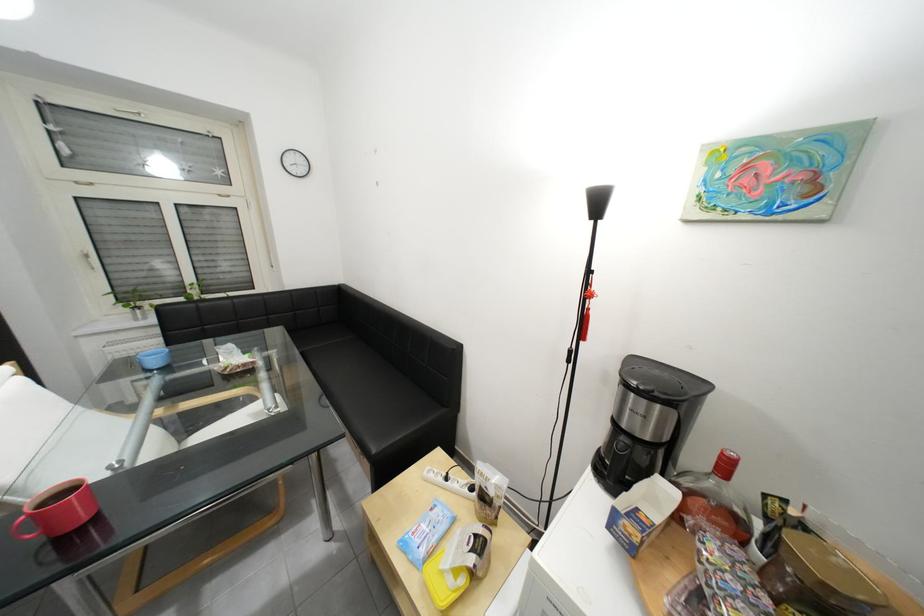
This screenshot has width=924, height=616. What do you see at coordinates (13, 531) in the screenshot?
I see `a red mug handle` at bounding box center [13, 531].